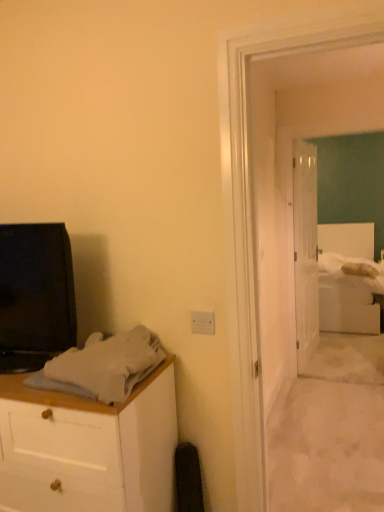
What is the approximate width of white soft bedsheet at center-right, the second sheet positioned from the left?

The width of white soft bedsheet at center-right, the second sheet positioned from the left, is 24.14 inches.

The height and width of the screenshot is (512, 384). In order to click on black glossy tv at left in this screenshot , I will do `click(35, 295)`.

The image size is (384, 512). What do you see at coordinates (346, 280) in the screenshot?
I see `white soft bed at right` at bounding box center [346, 280].

Measure the distance between point (63,353) and camera.

1.43 meters.

This screenshot has width=384, height=512. What are the coordinates of `white soft bedsheet at center-right, the second sheet positioned from the left` in the screenshot? It's located at (345, 263).

Does gray cotton sheet at left, which ranks as the 2th sheet in right-to-left order, have a lesser height compared to white soft bedsheet at center-right, positioned as the 1th sheet in back-to-front order?

Indeed, gray cotton sheet at left, which ranks as the 2th sheet in right-to-left order, has a lesser height compared to white soft bedsheet at center-right, positioned as the 1th sheet in back-to-front order.

Which is farther, (99, 384) or (378, 268)?

The point (378, 268) is farther.

How many degrees apart are the facing directions of gray cotton sheet at left, which is the 2th sheet from back to front, and white soft bedsheet at center-right, placed as the second sheet when sorted from front to back?

The angle between the facing direction of gray cotton sheet at left, which is the 2th sheet from back to front, and the facing direction of white soft bedsheet at center-right, placed as the second sheet when sorted from front to back, is 3.49 degrees.

In the scene shown: From a real-world perspective, is gray cotton sheet at left, which ranks as the 2th sheet in right-to-left order, physically located above or below white soft bedsheet at center-right, the first sheet when ordered from right to left?

gray cotton sheet at left, which ranks as the 2th sheet in right-to-left order, is situated higher than white soft bedsheet at center-right, the first sheet when ordered from right to left, in the real world.

Visually, is gray cotton sheet at left, which ranks as the 2th sheet in right-to-left order, positioned to the left or to the right of white soft bed at right?

From the image, it's evident that gray cotton sheet at left, which ranks as the 2th sheet in right-to-left order, is to the left of white soft bed at right.

Is the position of gray cotton sheet at left, which ranks as the 2th sheet in right-to-left order, more distant than that of white soft bed at right?

No, the depth of gray cotton sheet at left, which ranks as the 2th sheet in right-to-left order, is less than that of white soft bed at right.

Does gray cotton sheet at left, the second sheet from the top, have a larger size compared to white soft bed at right?

No, gray cotton sheet at left, the second sheet from the top, is not bigger than white soft bed at right.

From the image's perspective, which is below, white glossy door at center or white soft bed at right?

white soft bed at right, from the image's perspective.

Is white glossy door at center inside or outside of white soft bed at right?

The correct answer is: outside.

Looking at this image, considering the sizes of objects white glossy door at center and white soft bed at right in the image provided, who is shorter, white glossy door at center or white soft bed at right?

Standing shorter between the two is white soft bed at right.

Between white glossy door at center and white soft bed at right, which one has larger size?

With larger size is white soft bed at right.

This screenshot has height=512, width=384. I want to click on sheet below the black glossy tv at left (from the image's perspective), so click(105, 365).

Is gray cotton sheet at left, the first sheet in the bottom-to-top sequence, far away from black glossy tv at left?

gray cotton sheet at left, the first sheet in the bottom-to-top sequence, is actually quite close to black glossy tv at left.

In the scene shown: From a real-world perspective, is gray cotton sheet at left, marked as the first sheet in a left-to-right arrangement, physically above black glossy tv at left?

Actually, gray cotton sheet at left, marked as the first sheet in a left-to-right arrangement, is physically below black glossy tv at left in the real world.

Which object is wider, gray cotton sheet at left, the first sheet in the bottom-to-top sequence, or black glossy tv at left?

gray cotton sheet at left, the first sheet in the bottom-to-top sequence, is wider.

Is white glossy door at center turned away from white soft bedsheet at center-right, the 1th sheet from the top?

No, white glossy door at center is not facing the opposite direction of white soft bedsheet at center-right, the 1th sheet from the top.

From the image's perspective, who appears lower, white glossy door at center or white soft bedsheet at center-right, positioned as the 1th sheet in back-to-front order?

white soft bedsheet at center-right, positioned as the 1th sheet in back-to-front order.

Which is less distant, (305, 331) or (380, 270)?

The point (305, 331) is closer to the camera.

Which of these two, white glossy door at center or white soft bedsheet at center-right, the second sheet positioned from the left, is smaller?

Smaller between the two is white soft bedsheet at center-right, the second sheet positioned from the left.

Does white soft bed at right lie behind white soft bedsheet at center-right, the second sheet positioned from the left?

That is False.

Choose the correct answer: Is white soft bed at right inside white soft bedsheet at center-right, the second sheet from the bottom, or outside it?

white soft bed at right exists outside the volume of white soft bedsheet at center-right, the second sheet from the bottom.

Considering the sizes of objects white soft bed at right and white soft bedsheet at center-right, the second sheet positioned from the left, in the image provided, who is taller, white soft bed at right or white soft bedsheet at center-right, the second sheet positioned from the left,?

Standing taller between the two is white soft bed at right.

Is point (321, 266) more distant than point (33, 329)?

That is True.

Considering the relative sizes of white soft bedsheet at center-right, the second sheet from the bottom, and black glossy tv at left in the image provided, is white soft bedsheet at center-right, the second sheet from the bottom, shorter than black glossy tv at left?

Yes.

Does white soft bedsheet at center-right, placed as the second sheet when sorted from front to back, lie in front of black glossy tv at left?

No, it is behind black glossy tv at left.

Is white soft bedsheet at center-right, the second sheet positioned from the left, wider or thinner than black glossy tv at left?

white soft bedsheet at center-right, the second sheet positioned from the left, is wider than black glossy tv at left.

Locate an element on the screen. sheet that is in front of the white soft bedsheet at center-right, placed as the second sheet when sorted from front to back is located at coordinates (105, 365).

Locate an element on the screen. bed that is on the right side of gray cotton sheet at left, the second sheet from the top is located at coordinates (346, 280).

Looking at the image, which one is located further to gray cotton sheet at left, the first sheet in the bottom-to-top sequence, white soft bed at right or white soft bedsheet at center-right, the first sheet when ordered from right to left?

white soft bed at right lies further to gray cotton sheet at left, the first sheet in the bottom-to-top sequence, than the other object.

When comparing their distances from white glossy door at center, does black glossy tv at left or white soft bed at right seem closer?

white soft bed at right lies closer to white glossy door at center than the other object.

From the image, which object appears to be farther from white soft bed at right, white soft bedsheet at center-right, the first sheet when ordered from right to left, or white glossy door at center?

The object further to white soft bed at right is white glossy door at center.

Which object lies nearer to the anchor point white glossy door at center, black glossy tv at left or white soft bedsheet at center-right, the 1th sheet from the top?

white soft bedsheet at center-right, the 1th sheet from the top, is positioned closer to the anchor white glossy door at center.

When comparing their distances from white soft bed at right, does white glossy door at center or gray cotton sheet at left, the second sheet from the top, seem further?

gray cotton sheet at left, the second sheet from the top, is positioned further to the anchor white soft bed at right.

From the image, which object appears to be nearer to white soft bedsheet at center-right, the 1th sheet from the top, white glossy door at center or gray cotton sheet at left, which is the 2th sheet from back to front?

Among the two, white glossy door at center is located nearer to white soft bedsheet at center-right, the 1th sheet from the top.

Which object lies nearer to the anchor point black glossy tv at left, white soft bed at right or gray cotton sheet at left, marked as the first sheet in a left-to-right arrangement?

Among the two, gray cotton sheet at left, marked as the first sheet in a left-to-right arrangement, is located nearer to black glossy tv at left.

From the image, which object appears to be farther from white glossy door at center, white soft bed at right or gray cotton sheet at left, the first sheet in the bottom-to-top sequence?

Among the two, gray cotton sheet at left, the first sheet in the bottom-to-top sequence, is located further to white glossy door at center.

Identify the location of door between black glossy tv at left and white soft bedsheet at center-right, the second sheet from the bottom, in the front-back direction. (305, 250).

This screenshot has height=512, width=384. Find the location of `door between black glossy tv at left and white soft bed at right in the front-back direction`. door between black glossy tv at left and white soft bed at right in the front-back direction is located at coordinates (305, 250).

At what (x,y) coordinates should I click in order to perform the action: click on television between gray cotton sheet at left, which is the 2th sheet from back to front, and white glossy door at center from front to back. Please return your answer as a coordinate pair (x, y). Image resolution: width=384 pixels, height=512 pixels. Looking at the image, I should click on (35, 295).

Identify the location of door between gray cotton sheet at left, marked as the first sheet in a left-to-right arrangement, and white soft bed at right, along the z-axis. (305, 250).